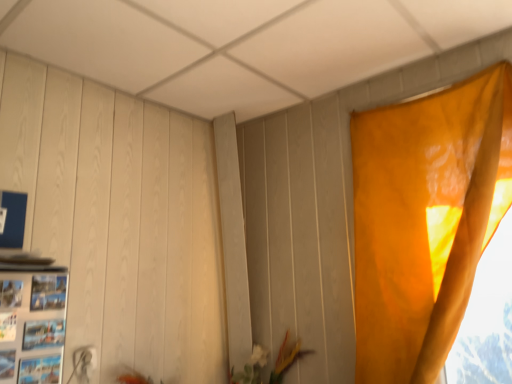
Question: Should I look upward or downward to see orange fabric curtain at right?

Choices:
 (A) down
 (B) up

Answer: (A)